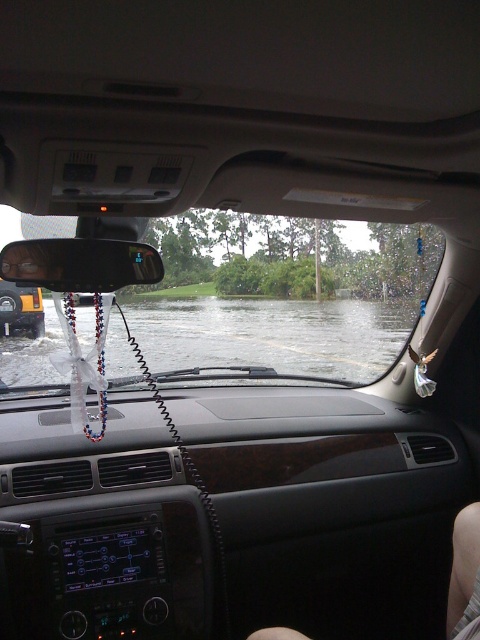
In the scene shown: You are driving a car with a 1.2 meter tall trunk. You see clear water at center ahead. Can your trunk clear the water without touching it?

The clear water at center is 3.83 meters away from the camera. Since the trunk is 1.2 meters tall, the trunk will not touch the water as the distance is sufficient.

You are inside a car and want to check the flooded road outside. Where exactly is the transparent glass windshield at center located in terms of coordinates?

The transparent glass windshield at center is located at coordinates point (285, 292).